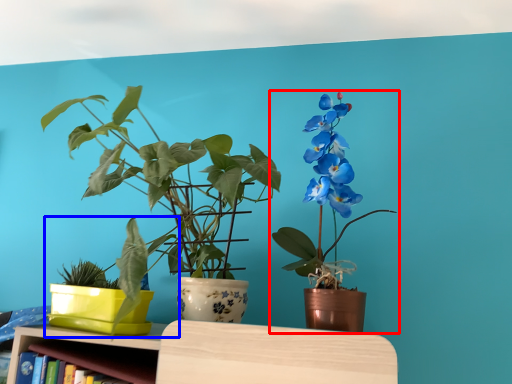
Question: Which point is closer to the camera, houseplant (highlighted by a red box) or houseplant (highlighted by a blue box)?

Choices:
 (A) houseplant
 (B) houseplant

Answer: (A)